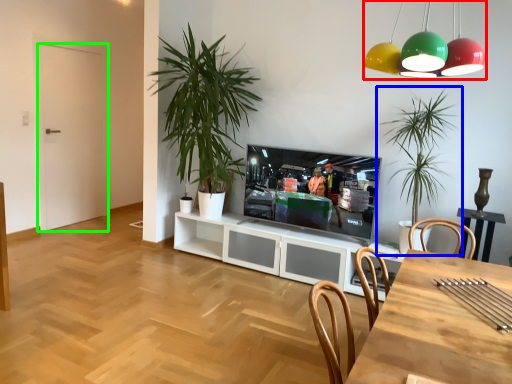
Question: Based on their relative distances, which object is farther from light fixture (highlighted by a red box)? Choose from houseplant (highlighted by a blue box) and door (highlighted by a green box).

Choices:
 (A) houseplant
 (B) door

Answer: (B)